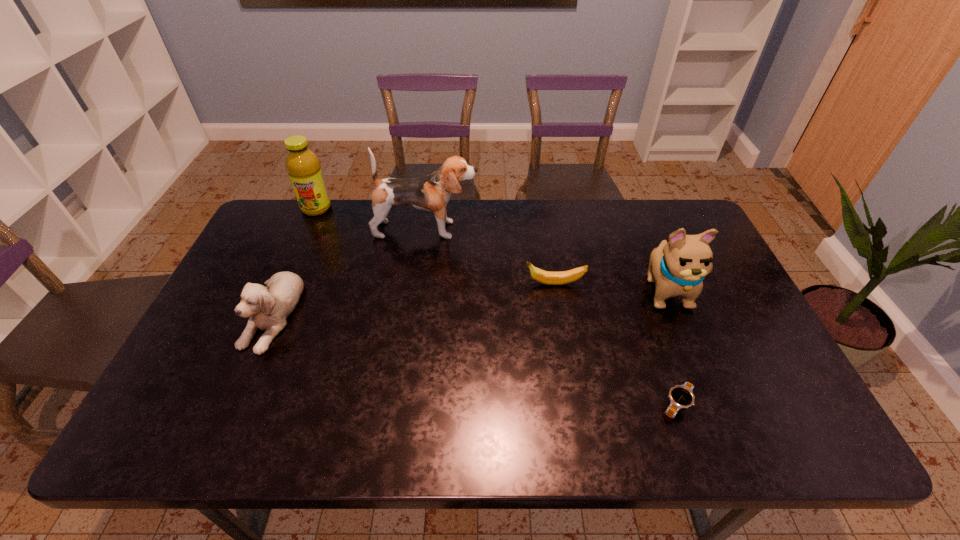
The width and height of the screenshot is (960, 540). Identify the location of vacant region located at the face of the third object from left to right. (529, 230).

The width and height of the screenshot is (960, 540). Find the location of `free space located 0.200m on the front label of the farthest object`. free space located 0.200m on the front label of the farthest object is located at coordinates (295, 257).

The width and height of the screenshot is (960, 540). I want to click on free region located 0.140m on the face of the second tallest puppy, so click(695, 361).

Locate an element on the screen. Image resolution: width=960 pixels, height=540 pixels. free space located 0.070m on the front-facing side of the leftmost puppy is located at coordinates (243, 381).

Identify the location of free location located at the stem of the fifth tallest object. Image resolution: width=960 pixels, height=540 pixels. 396,284.

You are a GUI agent. You are given a task and a screenshot of the screen. Output one action in this format:
    pyautogui.click(x=<x>, y=<y>)
    Task: Click on the vacant space located 0.200m at the stem of the fifth tallest object
    This screenshot has height=540, width=960.
    Given the screenshot: What is the action you would take?
    pyautogui.click(x=455, y=284)

Locate an element on the screen. This screenshot has width=960, height=540. free spot located 0.160m at the stem of the fifth tallest object is located at coordinates (469, 284).

Locate an element on the screen. free space located 0.200m on the left of the nearest object is located at coordinates (571, 404).

Where is `puppy situated at the far edge`? The width and height of the screenshot is (960, 540). puppy situated at the far edge is located at coordinates (431, 193).

This screenshot has width=960, height=540. I want to click on fruit juice located in the far edge section of the desktop, so click(x=304, y=169).